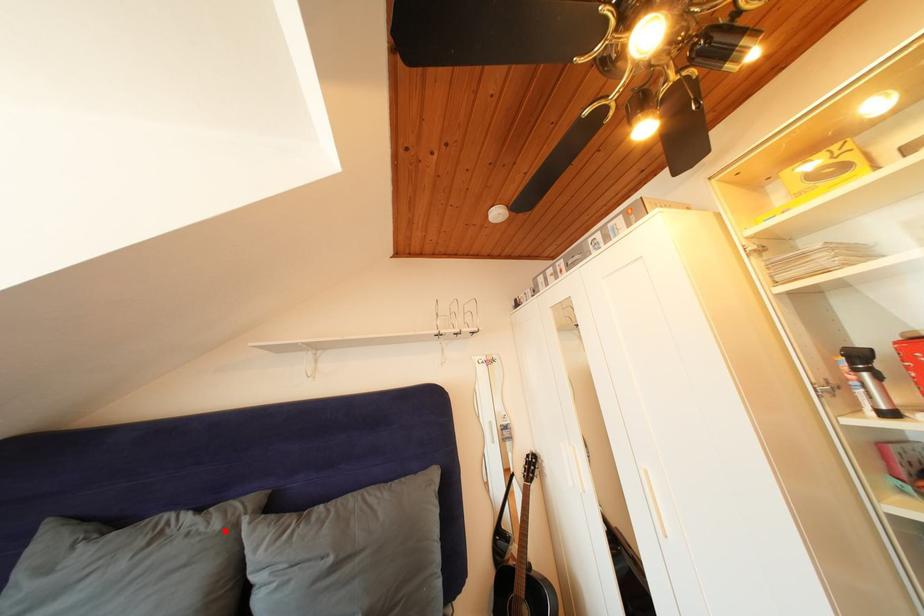
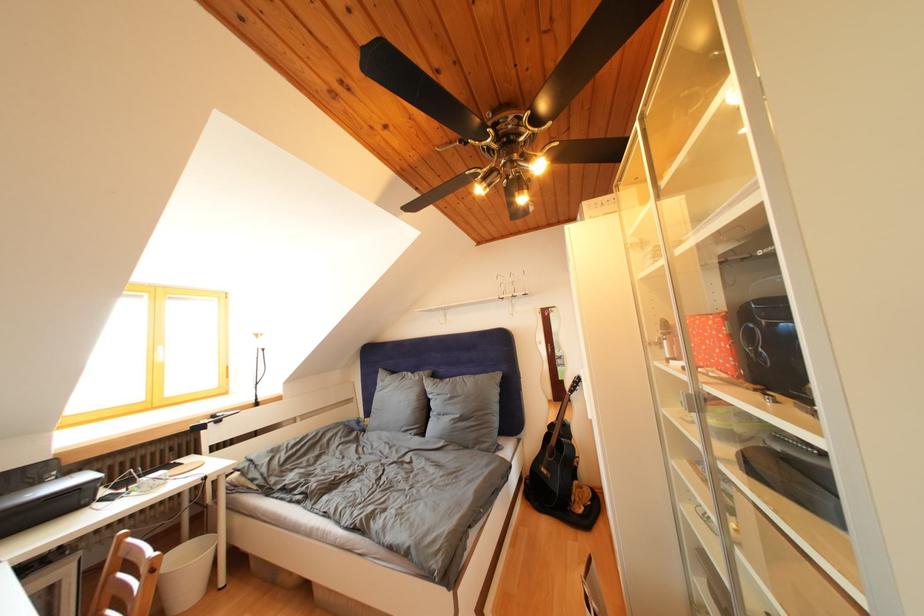
In the second image, find the point that corresponds to the highlighted location in the first image.

(426, 383)